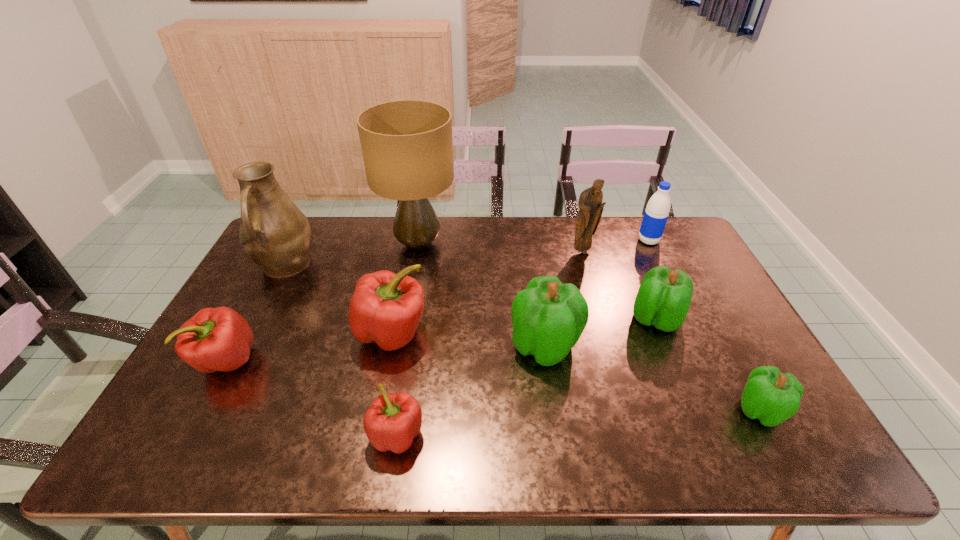
What are the coordinates of `free space located 0.370m on the back of the biggest green bell pepper` in the screenshot? It's located at (530, 244).

Find the location of a particular element. vacant space situated on the right of the biggest pink bell pepper is located at coordinates (562, 333).

The width and height of the screenshot is (960, 540). I want to click on vacant region located 0.290m on the front of the second green bell pepper from right to left, so click(x=704, y=435).

The image size is (960, 540). Find the location of `vacant region located 0.180m on the right of the leftmost bell pepper`. vacant region located 0.180m on the right of the leftmost bell pepper is located at coordinates (324, 360).

Where is `vacant space situated 0.180m on the left of the smallest green bell pepper`? The height and width of the screenshot is (540, 960). vacant space situated 0.180m on the left of the smallest green bell pepper is located at coordinates (661, 410).

I want to click on free location located 0.190m on the left of the smallest pink bell pepper, so click(287, 435).

Locate an element on the screen. The height and width of the screenshot is (540, 960). lampshade positioned at the far edge is located at coordinates (407, 146).

I want to click on pitcher that is at the far edge, so click(x=274, y=233).

This screenshot has height=540, width=960. Identify the location of figurine located at the far edge. (590, 204).

Locate an element on the screen. water bottle located at the far edge is located at coordinates (657, 210).